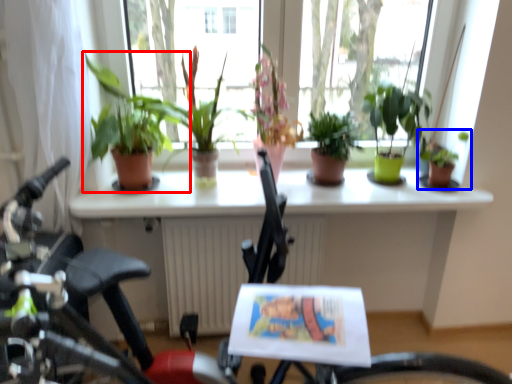
Question: Which point is further to the camera, houseplant (highlighted by a red box) or houseplant (highlighted by a blue box)?

Choices:
 (A) houseplant
 (B) houseplant

Answer: (B)